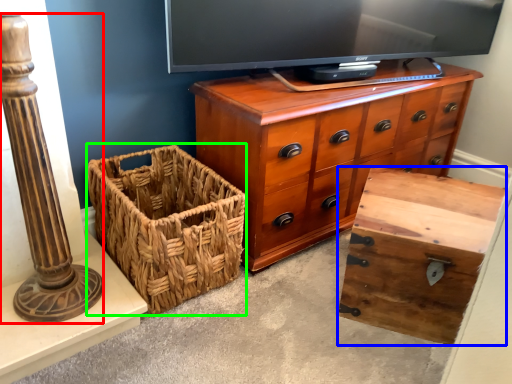
Question: Estimate the real-world distances between objects in this image. Which object is farther from pillar (highlighted by a red box), storage box (highlighted by a blue box) or basket (highlighted by a green box)?

Choices:
 (A) storage box
 (B) basket

Answer: (A)